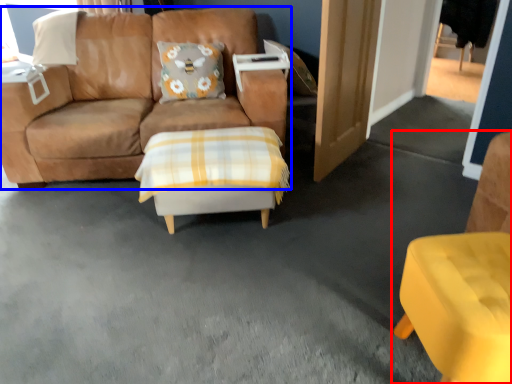
Question: Which object is further to the camera taking this photo, chair (highlighted by a red box) or studio couch (highlighted by a blue box)?

Choices:
 (A) chair
 (B) studio couch

Answer: (B)